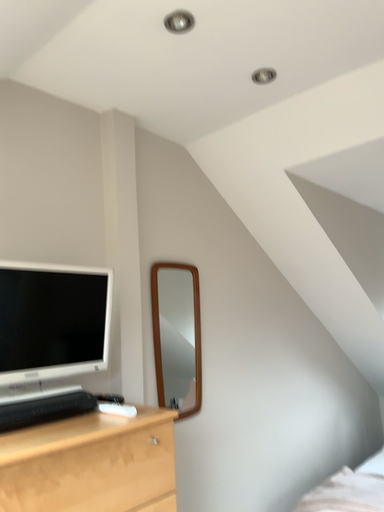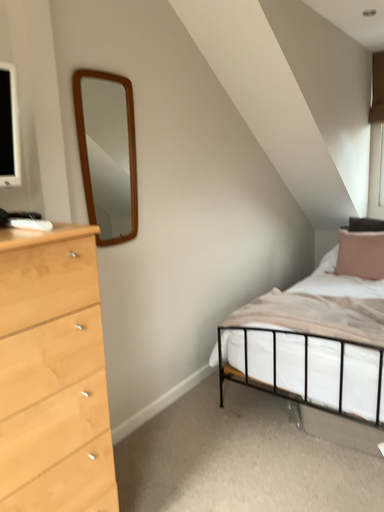
Question: How did the camera likely rotate when shooting the video?

Choices:
 (A) rotated upward
 (B) rotated downward

Answer: (B)